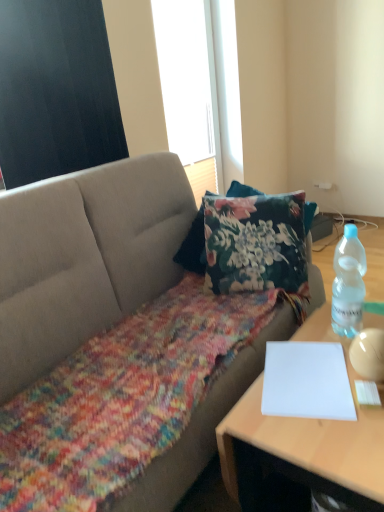
Question: In terms of size, does clear plastic bottle at right appear bigger or smaller than white paper at right?

Choices:
 (A) small
 (B) big

Answer: (A)

Question: Is clear plastic bottle at right wider or thinner than white paper at right?

Choices:
 (A) thin
 (B) wide

Answer: (A)

Question: Which object is the farthest from the textured gray couch at center?

Choices:
 (A) white paper at lower right
 (B) clear plastic bottle at right
 (C) white matte window screen at upper center, which is the 1th window screen from right to left
 (D) white paper at right
 (E) black matte window screen at upper left, which is the first window screen in front-to-back order

Answer: (C)

Question: Which object is positioned closest to the textured gray couch at center?

Choices:
 (A) white matte window screen at upper center, positioned as the 2th window screen in left-to-right order
 (B) clear plastic bottle at right
 (C) black matte window screen at upper left, arranged as the 1th window screen when viewed from the left
 (D) white paper at lower right
 (E) white paper at right

Answer: (C)